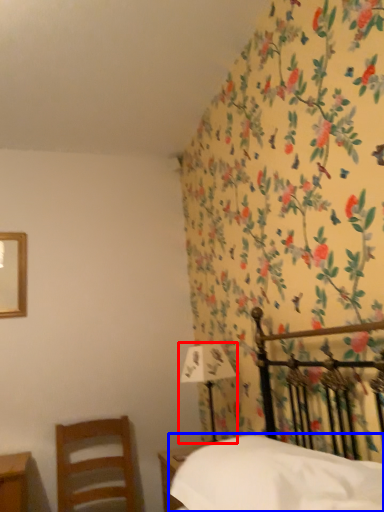
Question: Which point is further to the camera, bedside lamp (highlighted by a red box) or sheet (highlighted by a blue box)?

Choices:
 (A) bedside lamp
 (B) sheet

Answer: (A)